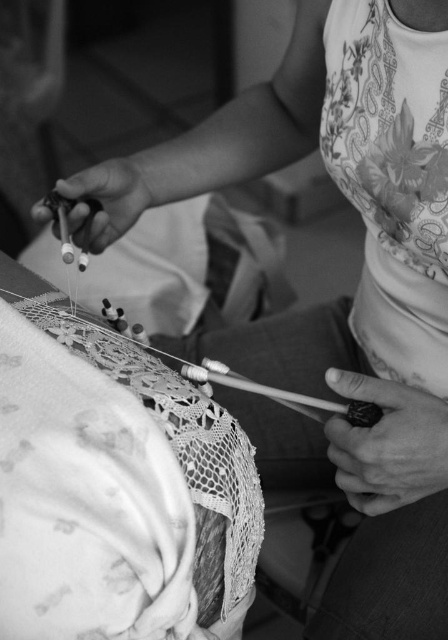
Question: Which object is closer to the camera taking this photo?

Choices:
 (A) lacy white fabric at center
 (B) metallic needle at center
 (C) smooth black tattoo at lower right

Answer: (A)

Question: Can you confirm if smooth black tattoo at lower right is smaller than metallic needle at center?

Choices:
 (A) yes
 (B) no

Answer: (A)

Question: Is smooth black tattoo at lower right positioned behind metallic needle at center?

Choices:
 (A) yes
 (B) no

Answer: (B)

Question: Based on their relative distances, which object is nearer to the lacy white fabric at center?

Choices:
 (A) smooth black tattoo at lower right
 (B) metallic needle at center

Answer: (A)

Question: Which point appears farthest from the camera in this image?

Choices:
 (A) (137, 593)
 (B) (360, 456)
 (C) (91, 182)

Answer: (C)

Question: Is lacy white fabric at center above smooth black tattoo at lower right?

Choices:
 (A) yes
 (B) no

Answer: (A)